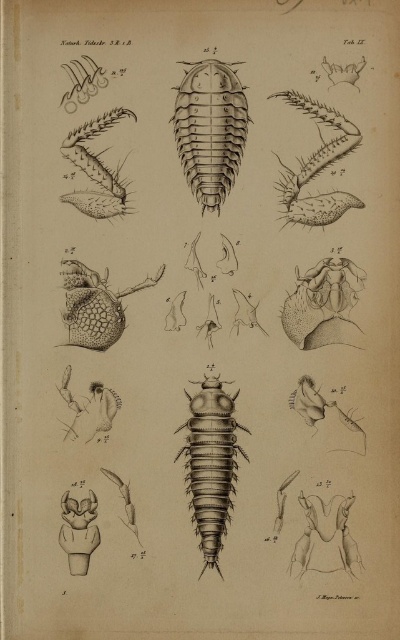
Question: Does smooth black insect at center have a smaller size compared to gray metallic insect at center?

Choices:
 (A) no
 (B) yes

Answer: (B)

Question: Among these points, which one is nearest to the camera?

Choices:
 (A) (200, 401)
 (B) (96, 204)
 (C) (186, 161)

Answer: (A)

Question: Which point appears farthest from the camera in this image?

Choices:
 (A) (122, 184)
 (B) (233, 429)

Answer: (A)

Question: Is gray metallic insect at center wider than smooth black insect at upper left?

Choices:
 (A) no
 (B) yes

Answer: (A)

Question: Which point is closer to the camera?

Choices:
 (A) smooth black insect at center
 (B) gray metallic insect at center

Answer: (B)

Question: Is smooth black insect at center smaller than smooth black insect at upper left?

Choices:
 (A) yes
 (B) no

Answer: (B)